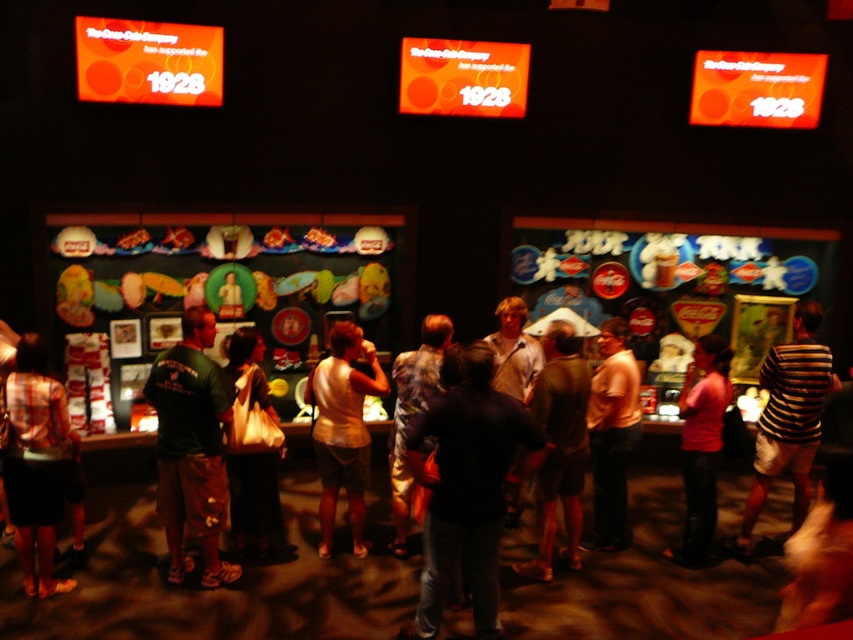
Can you confirm if white fabric bag at center is positioned to the right of pink fabric shirt at center?

In fact, white fabric bag at center is to the left of pink fabric shirt at center.

In the scene shown: Can you confirm if white fabric bag at center is positioned to the left of pink fabric shirt at center?

Indeed, white fabric bag at center is positioned on the left side of pink fabric shirt at center.

You are a GUI agent. You are given a task and a screenshot of the screen. Output one action in this format:
    pyautogui.click(x=<x>, y=<y>)
    Task: Click on the white fabric bag at center
    
    Given the screenshot: What is the action you would take?
    pyautogui.click(x=251, y=445)

Does dark blue shirt at center appear under pink fabric shirt at center?

Yes, dark blue shirt at center is below pink fabric shirt at center.

Consider the image. Which is above, dark blue shirt at center or pink fabric shirt at center?

pink fabric shirt at center is higher up.

At what (x,y) coordinates should I click in order to perform the action: click on dark blue shirt at center. Please return your answer as a coordinate pair (x, y). This screenshot has width=853, height=640. Looking at the image, I should click on (467, 484).

Who is shorter, matte black skirt at lower left or pink fabric shirt at center?

matte black skirt at lower left is shorter.

Consider the image. Does matte black skirt at lower left have a lesser height compared to pink fabric shirt at center?

Yes.

Is point (36, 339) farther from camera compared to point (712, 352)?

No, (36, 339) is in front of (712, 352).

Locate an element on the screen. This screenshot has width=853, height=640. matte black skirt at lower left is located at coordinates (35, 461).